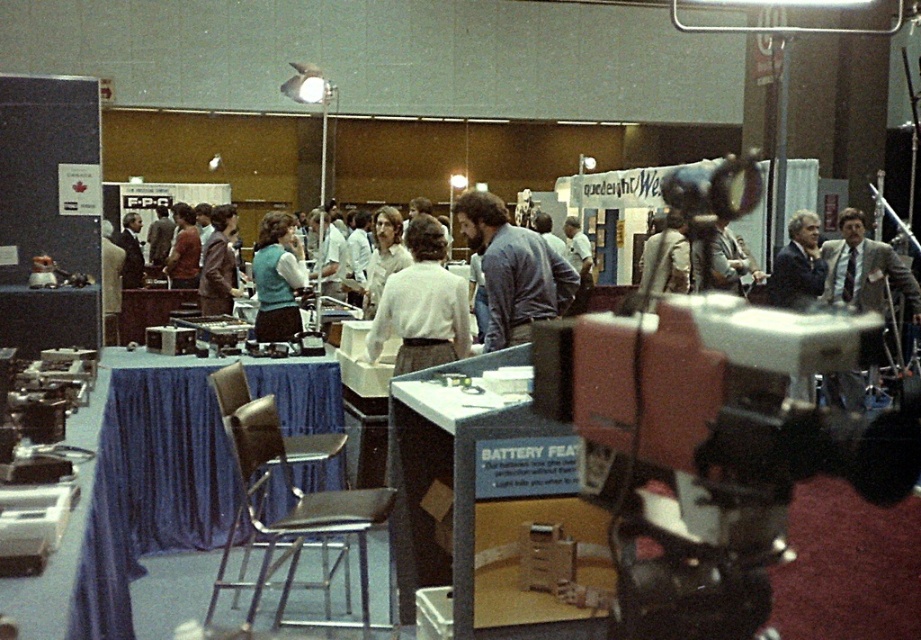
Question: Is gray suit at upper right smaller than blue denim vest at center?

Choices:
 (A) no
 (B) yes

Answer: (A)

Question: Which object is positioned closest to the blue denim vest at center?

Choices:
 (A) gray suit at upper right
 (B) matte black video camera at center
 (C) blue fabric vest at center

Answer: (C)

Question: Which point appears farthest from the camera in this image?

Choices:
 (A) (919, 316)
 (B) (492, 252)
 (C) (422, 257)
 (D) (263, 339)

Answer: (A)

Question: Is matte black video camera at center thinner than white fabric shirt at center?

Choices:
 (A) no
 (B) yes

Answer: (A)

Question: Which point is farther from the camera taking this photo?

Choices:
 (A) (642, 321)
 (B) (274, 253)

Answer: (B)

Question: Can you confirm if gray suit at upper right is positioned to the right of matte blue vest at center?

Choices:
 (A) no
 (B) yes

Answer: (B)